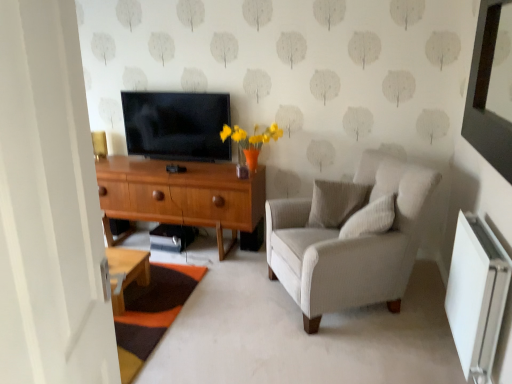
Question: Considering the positions of matte black tv at center and wooden desk at center in the image, is matte black tv at center taller or shorter than wooden desk at center?

Choices:
 (A) tall
 (B) short

Answer: (B)

Question: Is matte black tv at center wider or thinner than wooden desk at center?

Choices:
 (A) thin
 (B) wide

Answer: (A)

Question: Considering the real-world distances, which object is closest to the white textured pillow at upper right, marked as the first pillow in a front-to-back arrangement?

Choices:
 (A) white textured pillow at center, marked as the 2th pillow in a front-to-back arrangement
 (B) wooden desk at center
 (C) light gray fabric armchair at right
 (D) white plastic radiator at lower right
 (E) matte black tv at center

Answer: (C)

Question: Estimate the real-world distances between objects in this image. Which object is farther from the wooden desk at center?

Choices:
 (A) white plastic radiator at lower right
 (B) white textured pillow at center, which is counted as the 1th pillow, starting from the back
 (C) white textured pillow at upper right, marked as the first pillow in a front-to-back arrangement
 (D) matte black tv at center
 (E) light gray fabric armchair at right

Answer: (A)